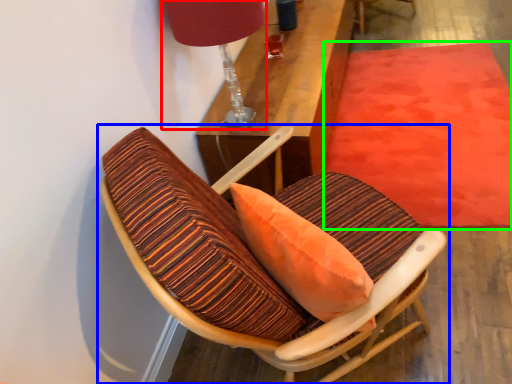
Question: Which object is the closest to the table lamp (highlighted by a red box)? Choose among these: chair (highlighted by a blue box) or mat (highlighted by a green box).

Choices:
 (A) chair
 (B) mat

Answer: (A)